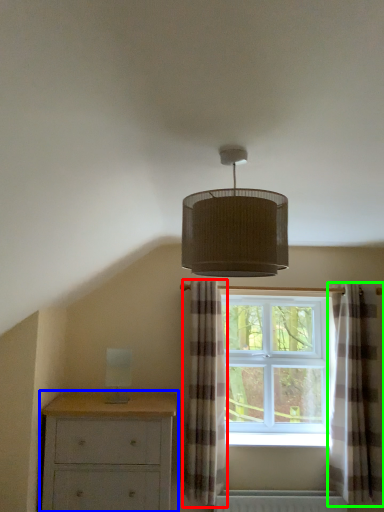
Question: Considering the real-world distances, which object is closest to curtain (highlighted by a red box)? chest of drawers (highlighted by a blue box) or curtain (highlighted by a green box).

Choices:
 (A) chest of drawers
 (B) curtain

Answer: (A)